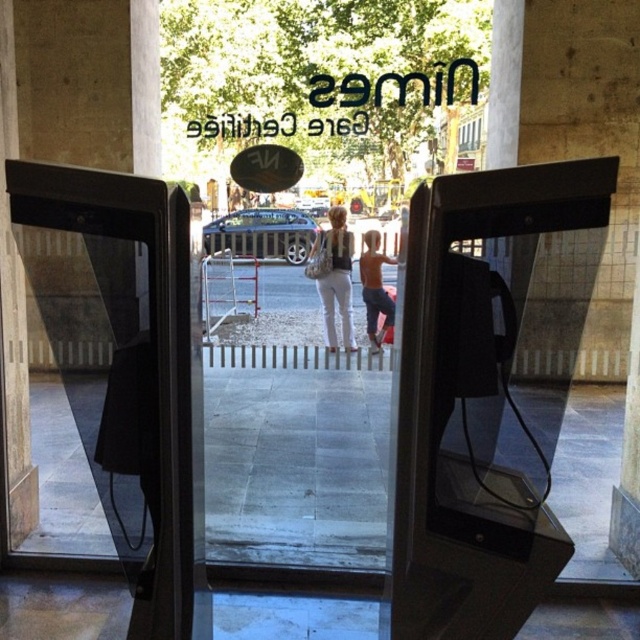
This screenshot has height=640, width=640. Identify the location of white cotton pants at center. (336, 276).

Which of these two, white cotton pants at center or shiny metallic shorts at center, stands shorter?

shiny metallic shorts at center is shorter.

Is point (340, 209) positioned behind point (372, 317)?

Yes.

Image resolution: width=640 pixels, height=640 pixels. Identify the location of white cotton pants at center. pos(336,276).

Between point (433, 252) and point (369, 278), which one is positioned behind?

The point (369, 278) is more distant.

Measure the distance from black plastic payphone at center to shiny metallic shorts at center.

black plastic payphone at center and shiny metallic shorts at center are 5.18 meters apart from each other.

Locate an element on the screen. black plastic payphone at center is located at coordinates (481, 396).

This screenshot has width=640, height=640. I want to click on black plastic payphone at center, so click(481, 396).

Which of these two, black plastic payphone at center or white cotton pants at center, stands taller?

Standing taller between the two is white cotton pants at center.

Does black plastic payphone at center appear on the right side of white cotton pants at center?

Indeed, black plastic payphone at center is positioned on the right side of white cotton pants at center.

You are a GUI agent. You are given a task and a screenshot of the screen. Output one action in this format:
    pyautogui.click(x=<x>, y=<y>)
    Task: Click on the black plastic payphone at center
    The width and height of the screenshot is (640, 640).
    Given the screenshot: What is the action you would take?
    pyautogui.click(x=481, y=396)

Locate an element on the screen. This screenshot has height=640, width=640. black plastic payphone at center is located at coordinates (481, 396).